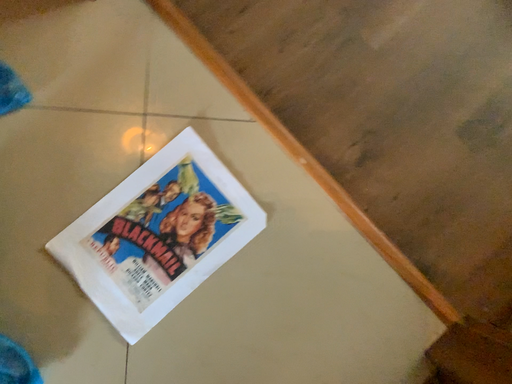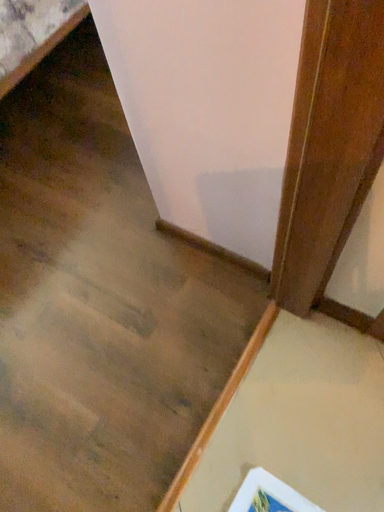
Question: Which way did the camera rotate in the video?

Choices:
 (A) rotated upward
 (B) rotated downward

Answer: (A)